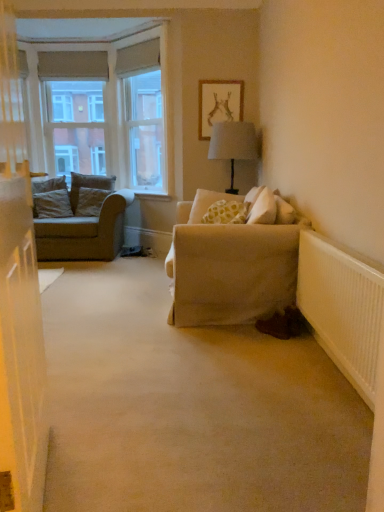
Question: From a real-world perspective, does white ribbed radiator at lower right stand above beige fabric couch at left?

Choices:
 (A) yes
 (B) no

Answer: (B)

Question: Can you see white ribbed radiator at lower right touching beige fabric couch at left?

Choices:
 (A) no
 (B) yes

Answer: (A)

Question: From a real-world perspective, is white ribbed radiator at lower right located beneath beige fabric couch at left?

Choices:
 (A) yes
 (B) no

Answer: (A)

Question: Would you say beige fabric couch at left is part of white ribbed radiator at lower right's contents?

Choices:
 (A) no
 (B) yes

Answer: (A)

Question: Does white ribbed radiator at lower right have a greater height compared to beige fabric couch at left?

Choices:
 (A) yes
 (B) no

Answer: (B)

Question: Can you confirm if white ribbed radiator at lower right is positioned to the right of beige fabric couch at left?

Choices:
 (A) no
 (B) yes

Answer: (B)

Question: From the image's perspective, is beige fabric couch at left located beneath light gray fabric pillow at left, arranged as the third pillow when viewed from the back?

Choices:
 (A) yes
 (B) no

Answer: (A)

Question: Is beige fabric couch at left aimed at light gray fabric pillow at left, which appears as the 2th pillow when viewed from the front?

Choices:
 (A) no
 (B) yes

Answer: (B)

Question: Is beige fabric couch at left in contact with light gray fabric pillow at left, which is the 4th pillow in right-to-left order?

Choices:
 (A) no
 (B) yes

Answer: (A)

Question: From a real-world perspective, is beige fabric couch at left located higher than light gray fabric pillow at left, which appears as the 2th pillow when viewed from the front?

Choices:
 (A) yes
 (B) no

Answer: (B)

Question: Is beige fabric couch at left positioned with its back to light gray fabric pillow at left, which appears as the 2th pillow when viewed from the front?

Choices:
 (A) no
 (B) yes

Answer: (B)

Question: Does beige fabric couch at left have a lesser width compared to light gray fabric pillow at left, arranged as the third pillow when viewed from the back?

Choices:
 (A) yes
 (B) no

Answer: (B)

Question: From the image's perspective, would you say matte wooden picture frame at upper center is positioned over beige fabric couch at left?

Choices:
 (A) no
 (B) yes

Answer: (B)